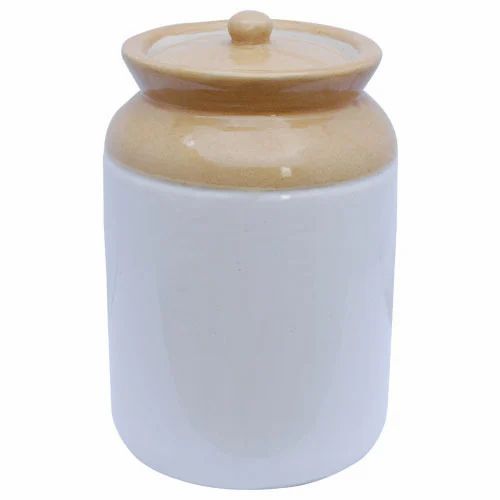
At what (x,y) coordinates should I click in order to perform the action: click on white jar base. Please return your answer as a coordinate pair (x, y). This screenshot has height=500, width=500. Looking at the image, I should click on (128, 380).